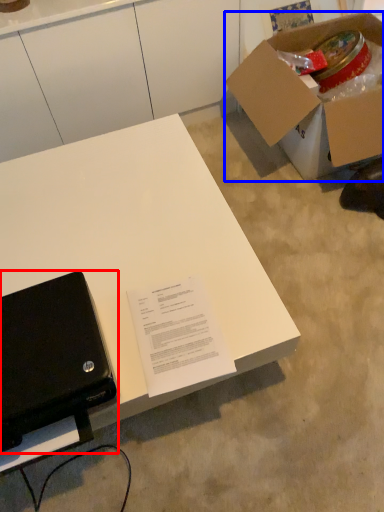
Question: Which object is further to the camera taking this photo, laptop (highlighted by a red box) or box (highlighted by a blue box)?

Choices:
 (A) laptop
 (B) box

Answer: (B)